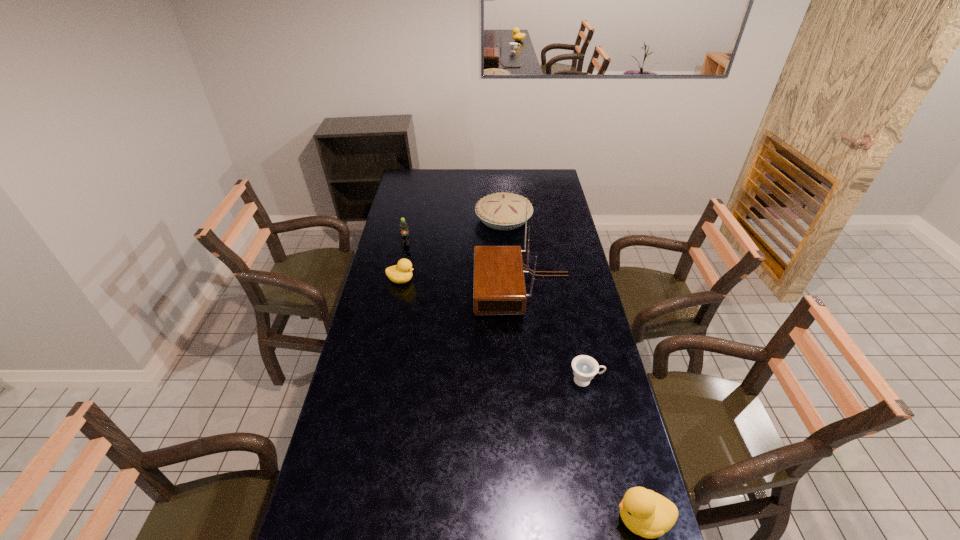
Find the location of a particular element. This screenshot has width=960, height=540. the farther duck is located at coordinates (402, 272).

Find the location of a particular element. the left duck is located at coordinates (402, 272).

Identify the location of the farthest object. The width and height of the screenshot is (960, 540). (502, 211).

This screenshot has width=960, height=540. Identify the location of radio_receiver. (499, 285).

Locate an element on the screen. The height and width of the screenshot is (540, 960). the fifth nearest object is located at coordinates (404, 233).

You are a GUI agent. You are given a task and a screenshot of the screen. Output one action in this format:
    pyautogui.click(x=<x>, y=<y>)
    Task: Click on the teacup
    
    Given the screenshot: What is the action you would take?
    pyautogui.click(x=585, y=367)

You are a GUI agent. You are given a task and a screenshot of the screen. Output one action in this format:
    pyautogui.click(x=<x>, y=<y>)
    Task: Click on the second nearest object
    The image size is (960, 540).
    Given the screenshot: What is the action you would take?
    pyautogui.click(x=585, y=367)

This screenshot has width=960, height=540. I want to click on vacant space located 0.340m on the front-facing side of the farther duck, so click(494, 280).

I want to click on blank space located 0.100m on the back of the farthest object, so click(x=502, y=194).

What are the coordinates of `vacant point located on the front panel of the radio_receiver` in the screenshot? It's located at (460, 288).